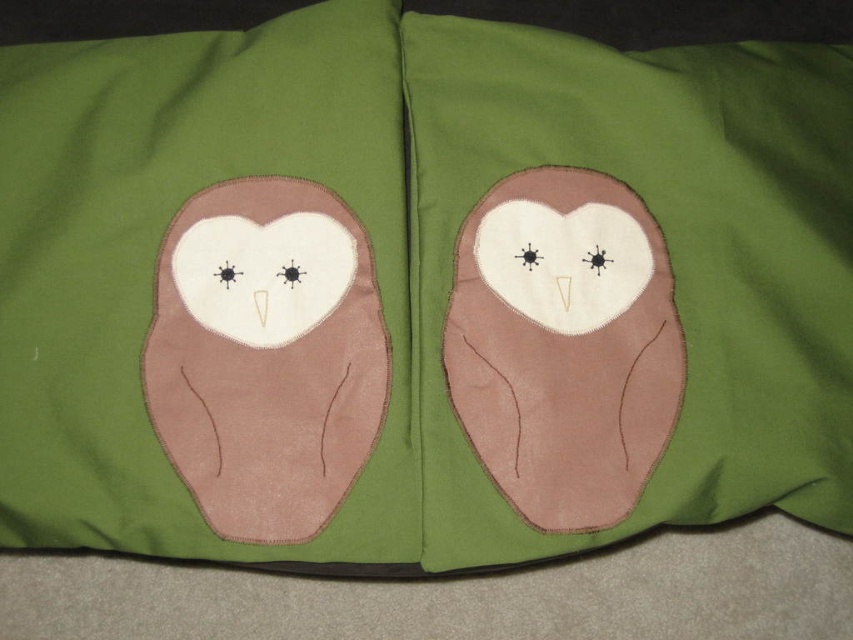
You are arranging two pillows for a cozy living room setup. You have the suede brown owl at center and the brown felt owl at center. If you want to place them in order from left to right, which owl should be on the left side?

The suede brown owl at center should be on the left side since it is positioned to the left of the brown felt owl at center according to the description.